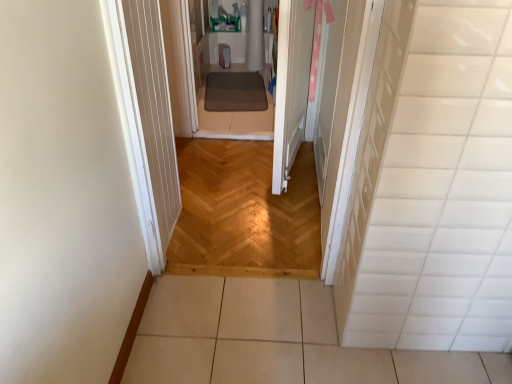
Where is `free spot above white tile floor at lower center (from a real-world perspective)`? free spot above white tile floor at lower center (from a real-world perspective) is located at coordinates (282, 333).